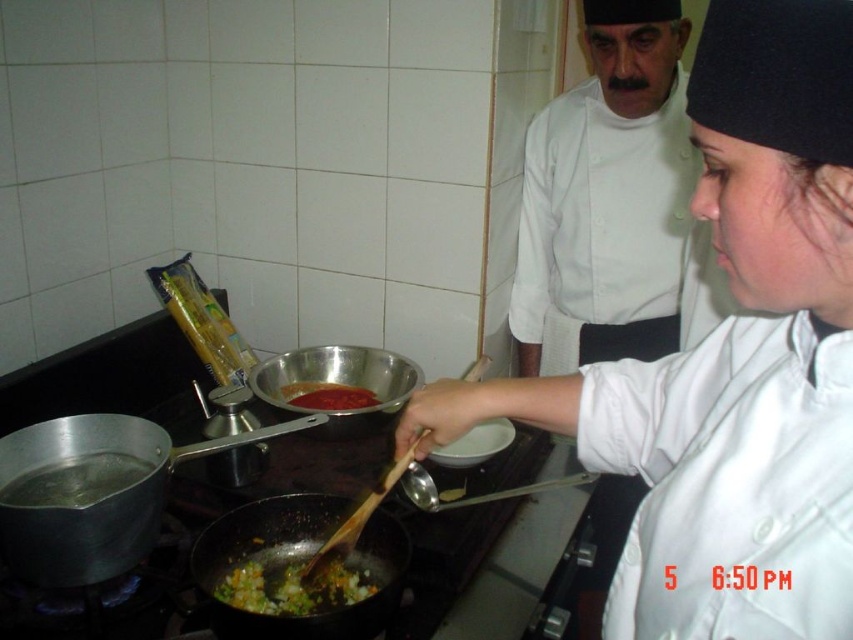
You are standing in the kitchen and want to reach the point at coordinates (265, 596). If your arm can extend 36 inches, can you reach that point without moving?

The point at coordinates (265, 596) is 39.10 inches away from you, which is beyond your arm reach of 36 inches. Therefore, you cannot reach it without moving.

You are a sous chef in a busy kitchen. You need to determine if the chopped vegetables at center can fit into the tomato sauce at center without spilling. Based on their sizes, what should you consider?

The chopped vegetables at center might be wider than tomato sauce at center, so there is a risk of spilling if placed directly into it. Consider transferring the vegetables carefully or using a larger container.